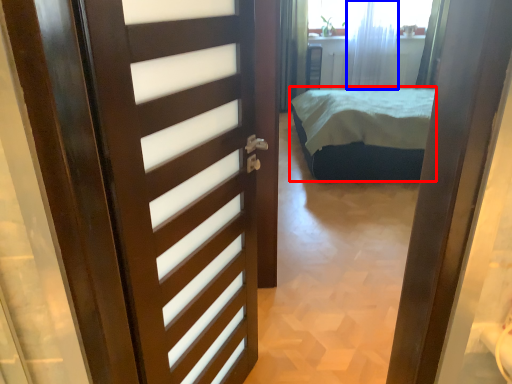
Question: Which point is further to the camera, bed (highlighted by a red box) or curtain (highlighted by a blue box)?

Choices:
 (A) bed
 (B) curtain

Answer: (B)